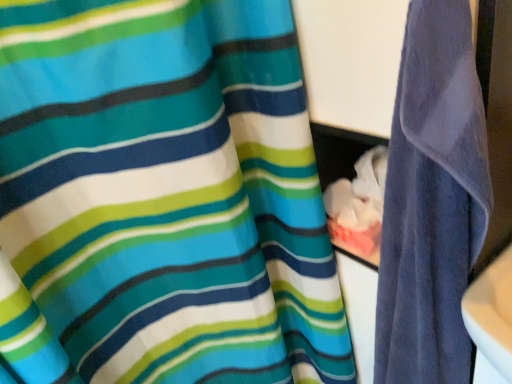
Find the location of a particular element. This screenshot has width=512, height=384. purple velvety towel at right is located at coordinates (432, 201).

Describe the element at coordinates (432, 201) in the screenshot. I see `purple velvety towel at right` at that location.

The width and height of the screenshot is (512, 384). I want to click on purple velvety towel at right, so (432, 201).